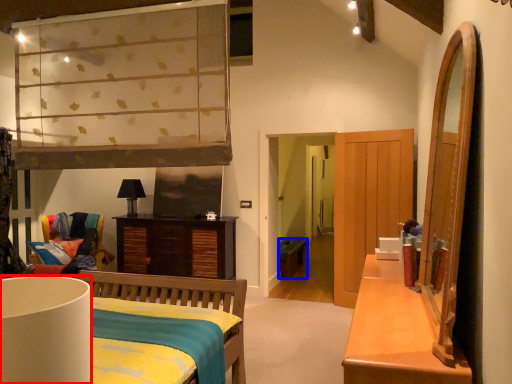
Question: Which point is closer to the camera, lamp (highlighted by a red box) or studio couch (highlighted by a blue box)?

Choices:
 (A) lamp
 (B) studio couch

Answer: (A)